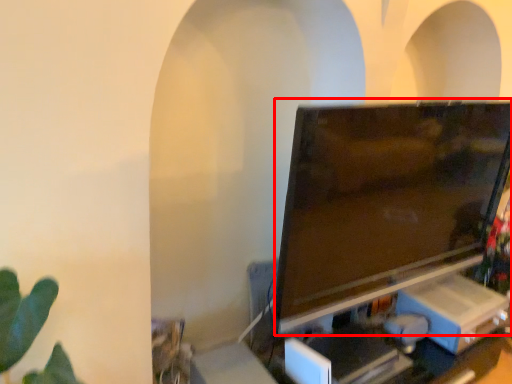
Question: From the image's perspective, where is television (annotated by the red box) located relative to computer desk?

Choices:
 (A) below
 (B) above

Answer: (B)